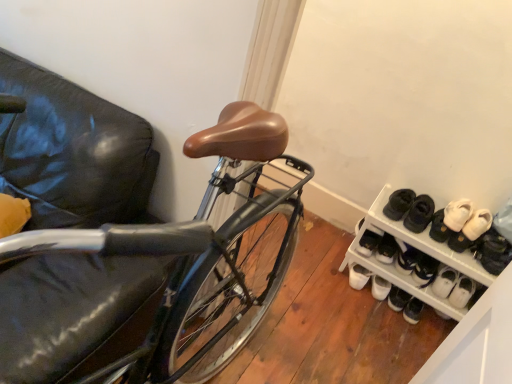
Question: Does white plastic shoe rack at lower right contain white suede sneakers at lower right, the first footwear in the left-to-right sequence?

Choices:
 (A) no
 (B) yes

Answer: (B)

Question: From the image's perspective, is white plastic shoe rack at lower right below white suede sneakers at lower right, the first footwear in the left-to-right sequence?

Choices:
 (A) yes
 (B) no

Answer: (A)

Question: Is white plastic shoe rack at lower right far from white suede sneakers at lower right, the first footwear in the left-to-right sequence?

Choices:
 (A) no
 (B) yes

Answer: (A)

Question: Is white plastic shoe rack at lower right thinner than white suede sneakers at lower right, which appears as the fourth footwear when viewed from the right?

Choices:
 (A) no
 (B) yes

Answer: (A)

Question: From a real-world perspective, is white plastic shoe rack at lower right over white suede sneakers at lower right, which appears as the fourth footwear when viewed from the right?

Choices:
 (A) no
 (B) yes

Answer: (A)

Question: Is the position of white plastic shoe rack at lower right more distant than that of white suede sneakers at lower right, the first footwear in the left-to-right sequence?

Choices:
 (A) yes
 (B) no

Answer: (B)

Question: Does white suede sneakers at lower right, acting as the third footwear starting from the left, have a lesser width compared to white suede shoes at right, which ranks as the 2th footwear in left-to-right order?

Choices:
 (A) no
 (B) yes

Answer: (A)

Question: Is white suede sneakers at lower right, the second footwear viewed from the right, in contact with white suede shoes at right, which ranks as the 2th footwear in left-to-right order?

Choices:
 (A) no
 (B) yes

Answer: (B)

Question: Is white suede sneakers at lower right, acting as the third footwear starting from the left, surrounding white suede shoes at right, which ranks as the 2th footwear in left-to-right order?

Choices:
 (A) yes
 (B) no

Answer: (B)

Question: Can you confirm if white suede sneakers at lower right, acting as the third footwear starting from the left, is bigger than white suede shoes at right, which ranks as the 2th footwear in left-to-right order?

Choices:
 (A) yes
 (B) no

Answer: (B)

Question: Does white suede sneakers at lower right, acting as the third footwear starting from the left, have a smaller size compared to white suede shoes at right, which is counted as the 3th footwear, starting from the right?

Choices:
 (A) no
 (B) yes

Answer: (B)

Question: From a real-world perspective, is white suede sneakers at lower right, acting as the third footwear starting from the left, physically above white suede shoes at right, which is counted as the 3th footwear, starting from the right?

Choices:
 (A) yes
 (B) no

Answer: (A)

Question: Is white suede sneakers at lower right, which ranks as the 4th footwear in left-to-right order, further to the viewer compared to white suede shoes at right, which is counted as the 3th footwear, starting from the right?

Choices:
 (A) no
 (B) yes

Answer: (A)